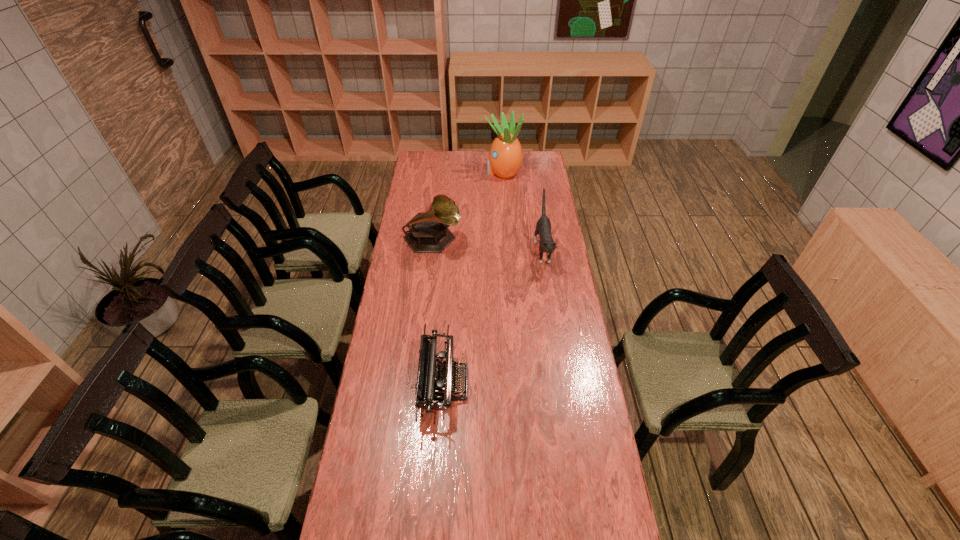
Locate an element on the screen. This screenshot has width=960, height=540. vacant space situated 0.250m at the face of the cat is located at coordinates (553, 319).

This screenshot has width=960, height=540. I want to click on vacant space located 0.120m on the typing side of the shortest object, so click(501, 384).

Where is `object that is at the far edge`? object that is at the far edge is located at coordinates (505, 158).

In order to click on object present at the left edge in this screenshot , I will do `click(428, 232)`.

The image size is (960, 540). Find the location of `pineapple positioned at the right edge`. pineapple positioned at the right edge is located at coordinates (505, 158).

This screenshot has height=540, width=960. I want to click on cat present at the right edge, so click(x=543, y=227).

Locate an element on the screen. The image size is (960, 540). object at the far right corner is located at coordinates (505, 158).

In the image, there is a desktop. Identify the location of free space at the far edge. The width and height of the screenshot is (960, 540). (459, 166).

Where is `vacant space at the left edge of the desktop`? The height and width of the screenshot is (540, 960). vacant space at the left edge of the desktop is located at coordinates (x=399, y=388).

In order to click on vacant space at the right edge of the desktop in this screenshot , I will do `click(591, 388)`.